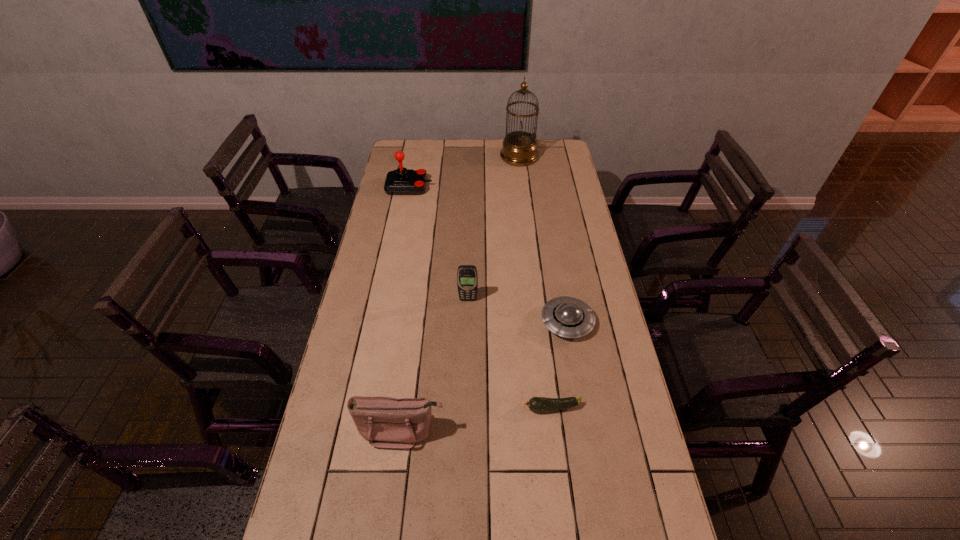
Locate an element on the screen. This screenshot has height=540, width=960. free spot that satisfies the following two spatial constraints: 1. with an open door on the fourth farthest object; 2. on the right side of the birdcage is located at coordinates (539, 322).

Find the location of a particular element. vacant point that satisfies the following two spatial constraints: 1. on the screen of the third object from left to right; 2. on the left side of the second shortest object is located at coordinates 468,322.

Identify the location of vacant space that satisfies the following two spatial constraints: 1. with an open door on the farthest object; 2. on the screen of the cellular telephone. (536, 300).

The width and height of the screenshot is (960, 540). I want to click on free space that satisfies the following two spatial constraints: 1. at the blossom end of the zucchini; 2. on the front pocket of the shoulder bag, so click(x=555, y=430).

Identify the location of free space in the image that satisfies the following two spatial constraints: 1. on the base of the second farthest object; 2. on the left side of the saucer. (383, 322).

I want to click on vacant point that satisfies the following two spatial constraints: 1. at the blossom end of the shortest object; 2. on the front pocket of the shoulder bag, so click(x=555, y=430).